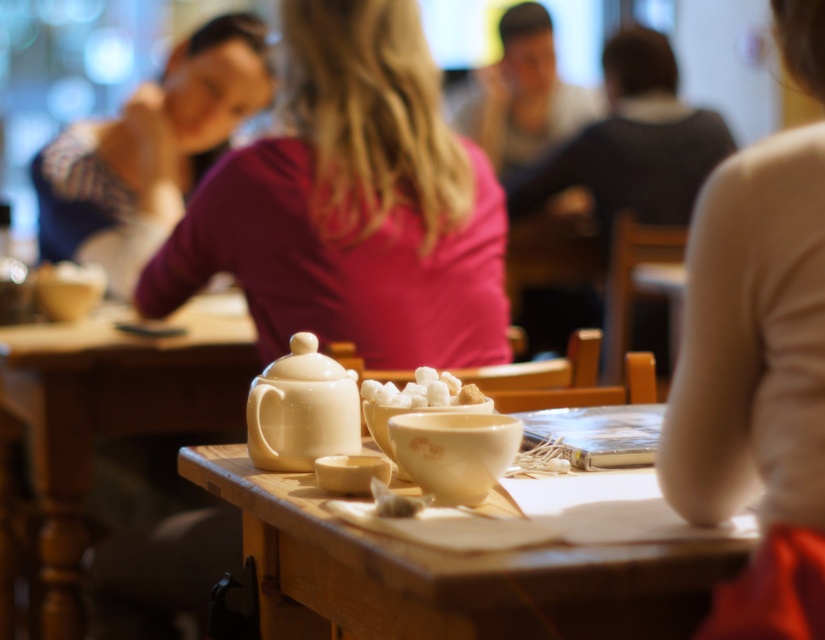
This screenshot has height=640, width=825. What are the coordinates of `matte pink shirt at center` in the screenshot? It's located at (352, 205).

This screenshot has width=825, height=640. Describe the element at coordinates (449, 572) in the screenshot. I see `matte ceramic table at center` at that location.

Can you confirm if matte ceramic table at center is positioned to the left of white sugar cubes at center?

Indeed, matte ceramic table at center is positioned on the left side of white sugar cubes at center.

Locate an element on the screen. This screenshot has width=825, height=640. matte ceramic table at center is located at coordinates (449, 572).

At what (x,y) coordinates should I click in order to perform the action: click on matte ceramic table at center. Please return your answer as a coordinate pair (x, y). Looking at the image, I should click on (449, 572).

The width and height of the screenshot is (825, 640). What do you see at coordinates (352, 205) in the screenshot? I see `matte pink shirt at center` at bounding box center [352, 205].

Does matte pink shirt at center lie behind white ceramic cup at center?

Yes, matte pink shirt at center is further from the viewer.

Describe the element at coordinates (352, 205) in the screenshot. This screenshot has height=640, width=825. I see `matte pink shirt at center` at that location.

The width and height of the screenshot is (825, 640). What are the coordinates of `matte pink shirt at center` in the screenshot? It's located at (352, 205).